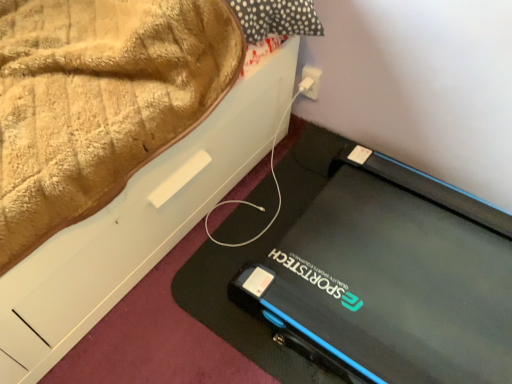
Question: Considering the positions of point (259, 119) and point (314, 89), is point (259, 119) closer or farther from the camera than point (314, 89)?

Choices:
 (A) farther
 (B) closer

Answer: (B)

Question: From a real-world perspective, is black rubber mat at lower right above or below white plastic plug at upper right?

Choices:
 (A) above
 (B) below

Answer: (B)

Question: Is black rubber mat at lower right wider or thinner than white plastic plug at upper right?

Choices:
 (A) thin
 (B) wide

Answer: (B)

Question: From their relative heights in the image, would you say white plastic plug at upper right is taller or shorter than black rubber mat at lower right?

Choices:
 (A) tall
 (B) short

Answer: (A)

Question: From the image's perspective, is white plastic plug at upper right above or below black rubber mat at lower right?

Choices:
 (A) below
 (B) above

Answer: (B)

Question: Do you think white plastic plug at upper right is within black rubber mat at lower right, or outside of it?

Choices:
 (A) inside
 (B) outside

Answer: (B)

Question: In terms of width, does white plastic plug at upper right look wider or thinner when compared to black rubber mat at lower right?

Choices:
 (A) thin
 (B) wide

Answer: (A)